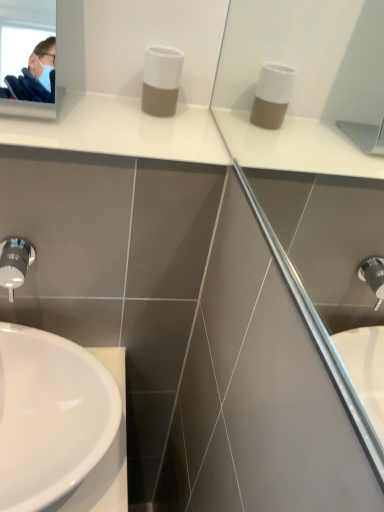
The height and width of the screenshot is (512, 384). What do you see at coordinates (161, 80) in the screenshot?
I see `white matte soap dispenser at center` at bounding box center [161, 80].

Find the location of a particular element. The height and width of the screenshot is (512, 384). satin nickel faucet at lower left is located at coordinates (15, 263).

From a real-world perspective, is white matte soap dispenser at center beneath satin nickel faucet at lower left?

No.

Is white matte soap dispenser at center in front of satin nickel faucet at lower left?

That is False.

Is white matte soap dispenser at center at the right side of satin nickel faucet at lower left?

Correct, you'll find white matte soap dispenser at center to the right of satin nickel faucet at lower left.

Looking at this image, does white glossy sink at lower left have a lesser height compared to satin nickel faucet at lower left?

No.

Can you confirm if white glossy sink at lower left is wider than satin nickel faucet at lower left?

Indeed, white glossy sink at lower left has a greater width compared to satin nickel faucet at lower left.

Locate an element on the screen. sink that appears below the satin nickel faucet at lower left (from the image's perspective) is located at coordinates (58, 426).

How far apart are white glossy sink at lower left and satin nickel faucet at lower left?

white glossy sink at lower left is 8.98 inches from satin nickel faucet at lower left.

From the picture: Who is shorter, white matte soap dispenser at center or white glossy sink at lower left?

Standing shorter between the two is white glossy sink at lower left.

Image resolution: width=384 pixels, height=512 pixels. Find the location of `soap dispenser on the right of the white glossy sink at lower left`. soap dispenser on the right of the white glossy sink at lower left is located at coordinates (161, 80).

From the image's perspective, which one is positioned lower, white matte soap dispenser at center or white glossy sink at lower left?

white glossy sink at lower left is shown below in the image.

From a real-world perspective, which object rests below the other?

white glossy sink at lower left.

Is satin nickel faucet at lower left oriented away from white glossy sink at lower left?

No, satin nickel faucet at lower left is not facing away from white glossy sink at lower left.

Is satin nickel faucet at lower left far away from white glossy sink at lower left?

That's not correct — satin nickel faucet at lower left is a little close to white glossy sink at lower left.

Which of these two, satin nickel faucet at lower left or white glossy sink at lower left, stands taller?

With more height is white glossy sink at lower left.

Considering the positions of objects satin nickel faucet at lower left and white glossy sink at lower left in the image provided, who is behind, satin nickel faucet at lower left or white glossy sink at lower left?

satin nickel faucet at lower left is further away from the camera.

Is white glossy sink at lower left directly adjacent to white matte soap dispenser at center?

white glossy sink at lower left is not next to white matte soap dispenser at center, and they're not touching.

Is white glossy sink at lower left located outside white matte soap dispenser at center?

Yes, white glossy sink at lower left is outside of white matte soap dispenser at center.

From the picture: From a real-world perspective, which is physically above, white glossy sink at lower left or white matte soap dispenser at center?

From a 3D spatial view, white matte soap dispenser at center is above.

Is the depth of satin nickel faucet at lower left greater than that of white matte soap dispenser at center?

No, the depth of satin nickel faucet at lower left is less than that of white matte soap dispenser at center.

From the image's perspective, which is below, satin nickel faucet at lower left or white matte soap dispenser at center?

satin nickel faucet at lower left, from the image's perspective.

Is satin nickel faucet at lower left not near white matte soap dispenser at center?

No.

Where is `tap below the white matte soap dispenser at center (from a real-world perspective)`? This screenshot has height=512, width=384. tap below the white matte soap dispenser at center (from a real-world perspective) is located at coordinates (15, 263).

Locate an element on the screen. Image resolution: width=384 pixels, height=512 pixels. sink in front of the satin nickel faucet at lower left is located at coordinates (58, 426).

In the scene shown: When comparing their distances from white glossy sink at lower left, does white matte soap dispenser at center or satin nickel faucet at lower left seem further?

Among the two, white matte soap dispenser at center is located further to white glossy sink at lower left.

Looking at this image, considering their positions, is satin nickel faucet at lower left positioned closer to white glossy sink at lower left than white matte soap dispenser at center?

satin nickel faucet at lower left is positioned closer to the anchor white glossy sink at lower left.

Considering their positions, is white glossy sink at lower left positioned further to white matte soap dispenser at center than satin nickel faucet at lower left?

white glossy sink at lower left is positioned further to the anchor white matte soap dispenser at center.

Based on their spatial positions, is white glossy sink at lower left or white matte soap dispenser at center further from satin nickel faucet at lower left?

white matte soap dispenser at center.

When comparing their distances from white matte soap dispenser at center, does satin nickel faucet at lower left or white glossy sink at lower left seem closer?

satin nickel faucet at lower left.

Consider the image. When comparing their distances from satin nickel faucet at lower left, does white matte soap dispenser at center or white glossy sink at lower left seem closer?

white glossy sink at lower left.

This screenshot has height=512, width=384. What are the coordinates of `tap between white matte soap dispenser at center and white glossy sink at lower left vertically` in the screenshot? It's located at (15, 263).